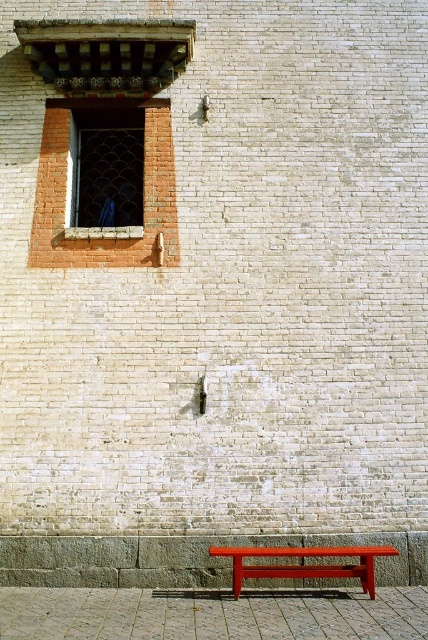
You are a painter who wants to place a new painting on the wall. The painting is the same size as the matte red bench at lower center. Will it fit in the space currently occupied by the matte glass window at upper left?

The matte glass window at upper left occupies less space than the matte red bench at lower center. Therefore, the painting would not fit in the space currently occupied by the matte glass window at upper left because the window is smaller than the bench.

You are a window cleaner who needs to clean the matte glass window at upper left and the matte red bench at lower center. Which object requires you to use a ladder to reach it?

The matte glass window at upper left requires a ladder because it is taller than the matte red bench at lower center.